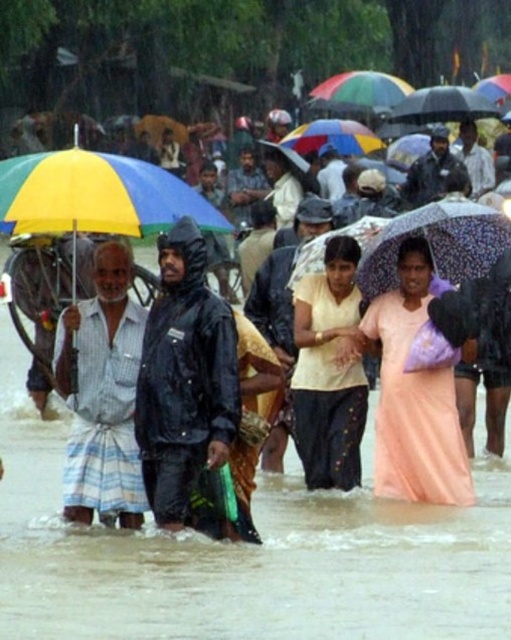
You are a delivery person needing to cross the flooded area. The black matte raincoat at center is 1.09 meters away from the striped fabric dhoti at left. Can you safely walk between them if your delivery cart is 1 meter wide?

The distance between the black matte raincoat at center and the striped fabric dhoti at left is 1.09 meters. Since your delivery cart is 1 meter wide, there is enough space to safely navigate between them.

Consider the image. You are a pedestrian trying to cross the flooded area. You see the black matte raincoat at center and the yellow matte shirt at center. Which one is closer to you?

The black matte raincoat at center is closer to you because it is in front of the yellow matte shirt at center.

Based on the photo, you are a photographer trying to capture a clear shot of both the striped fabric dhoti at left and the pink satin dress at center. Since you want both subjects in focus, which one should you adjust your camera focus on first?

You should focus on the striped fabric dhoti at left first because it is closer to the viewer than the pink satin dress at center. By focusing on the closer object, you can ensure that both will be in focus due to the depth of field extending from the near subject to the far subject.